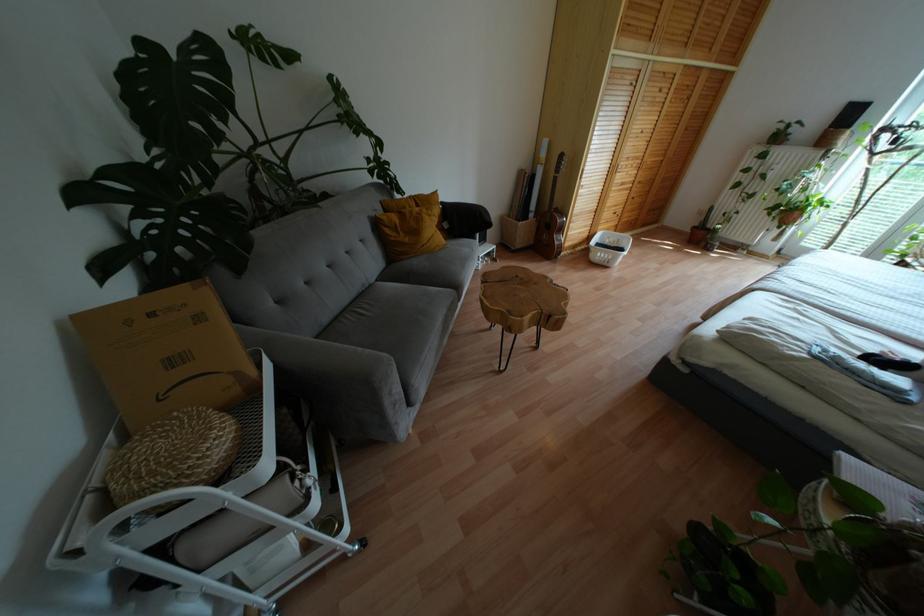
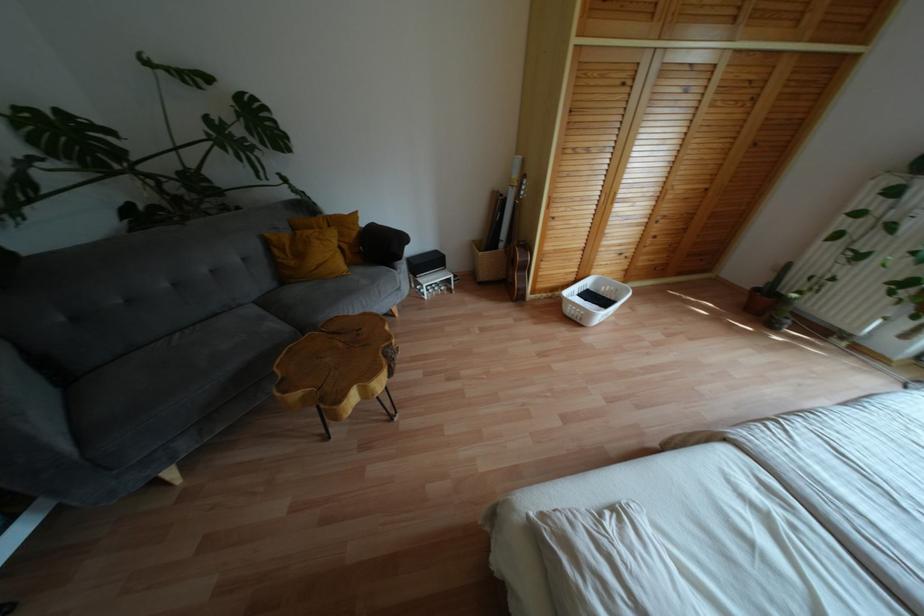
Where in the second image is the point corresponding to (517,286) from the first image?

(341, 344)